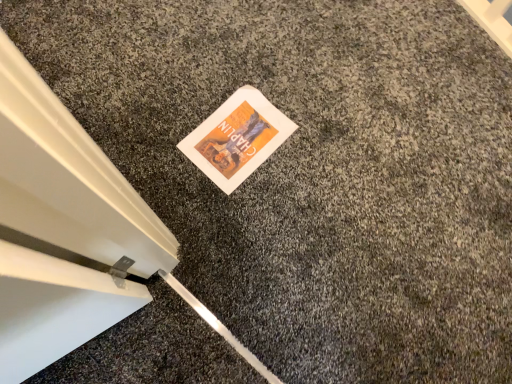
Locate an element on the screen. This screenshot has height=384, width=512. vacant space to the right of white paper at center is located at coordinates (313, 147).